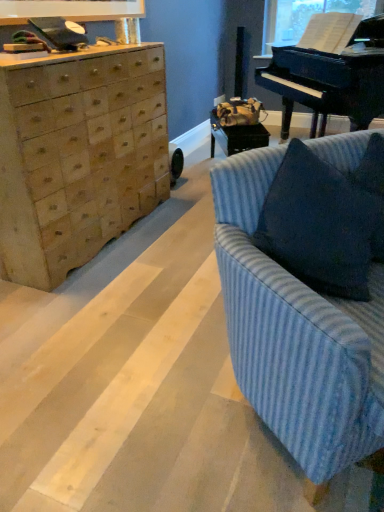
Locate an element on the screen. Image resolution: width=384 pixels, height=512 pixels. free point in front of natural wood chest of drawers at left is located at coordinates (109, 317).